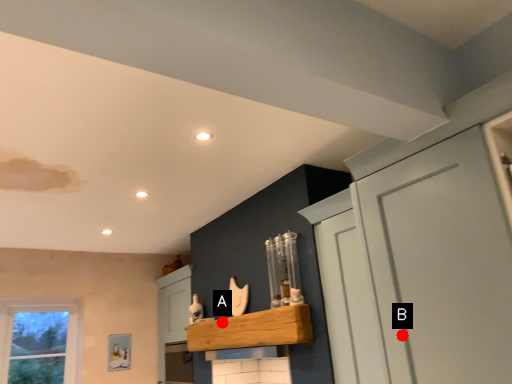
Question: Two points are circled on the image, labeled by A and B beside each circle. Which point is closer to the camera taking this photo?

Choices:
 (A) A is closer
 (B) B is closer

Answer: (B)